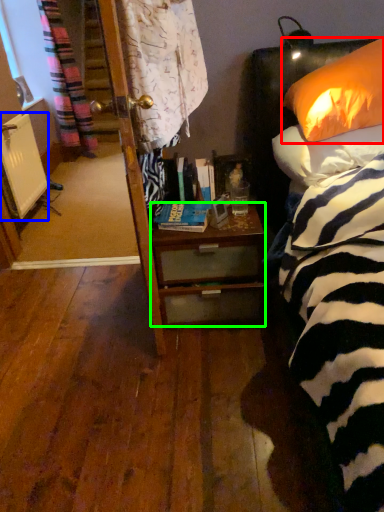
Question: Which object is positioned farthest from pillow (highlighted by a red box)? Select from radiator (highlighted by a blue box) and desk (highlighted by a green box).

Choices:
 (A) radiator
 (B) desk

Answer: (A)